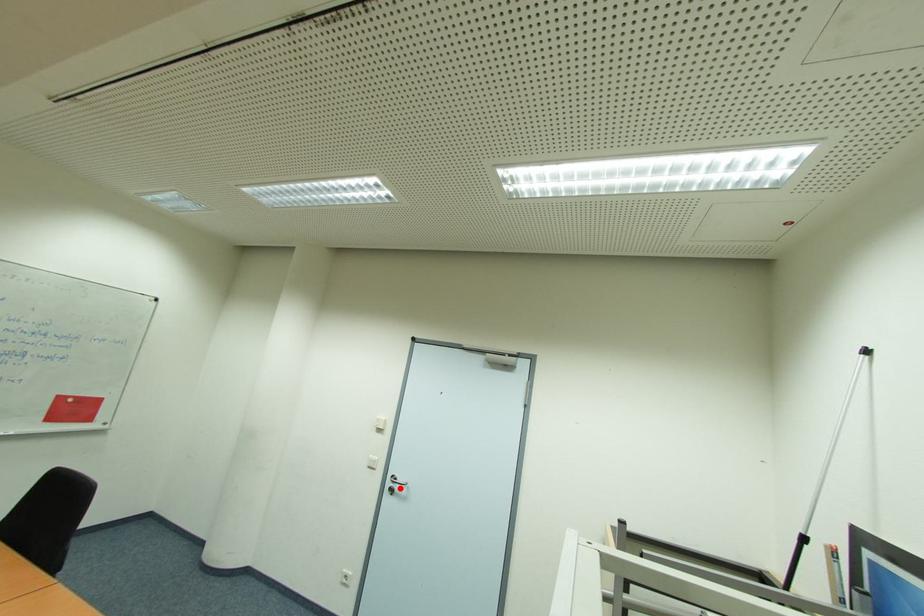
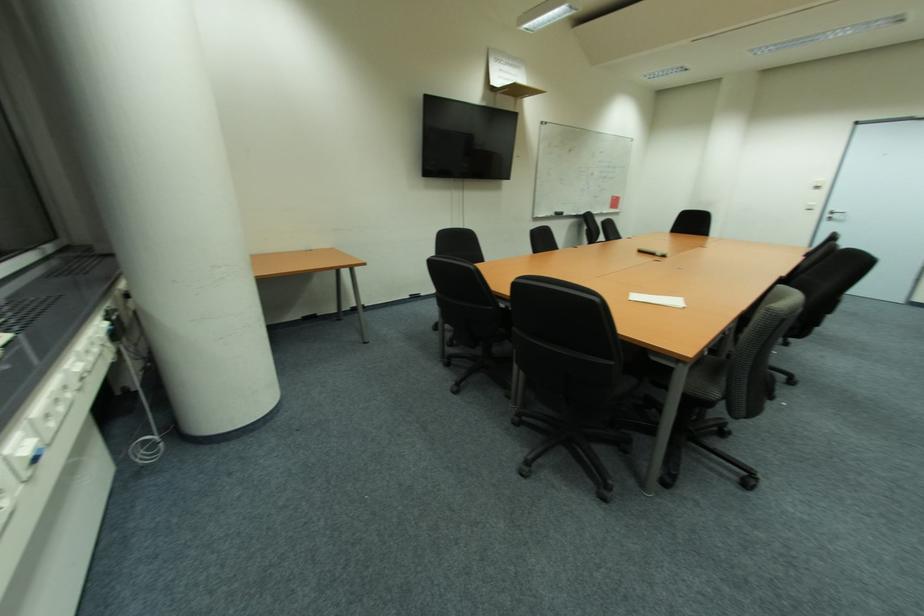
Question: A red point is marked in image1. In image2, is the corresponding 3D point closer to the camera or farther? Reply with the corresponding letter.

Choices:
 (A) The corresponding 3D point is closer.
 (B) The corresponding 3D point is farther.

Answer: (B)